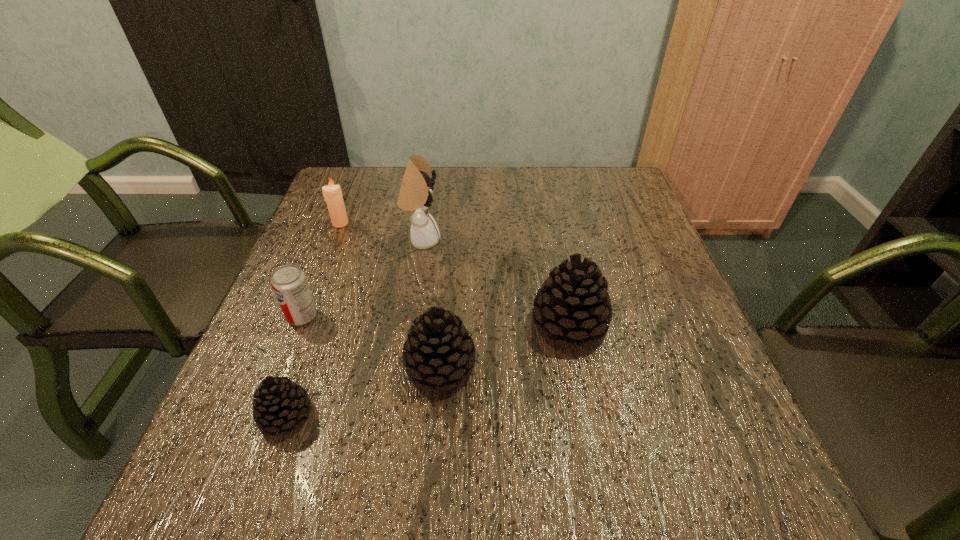
This screenshot has width=960, height=540. I want to click on the shortest pinecone, so click(x=280, y=403).

Find the location of a particular element. The width and height of the screenshot is (960, 540). the leftmost pinecone is located at coordinates pos(280,403).

The width and height of the screenshot is (960, 540). I want to click on the second pinecone from right to left, so click(439, 350).

Find the location of a particular element. The width and height of the screenshot is (960, 540). the rightmost pinecone is located at coordinates (573, 303).

Where is `doll`? doll is located at coordinates (415, 195).

Where is `candle`? The width and height of the screenshot is (960, 540). candle is located at coordinates (332, 194).

Identify the location of soda. The width and height of the screenshot is (960, 540). (289, 283).

The width and height of the screenshot is (960, 540). Find the location of `free location located 0.400m at the narrow end of the second pinecone from right to left`. free location located 0.400m at the narrow end of the second pinecone from right to left is located at coordinates (684, 366).

You are a GUI agent. You are given a task and a screenshot of the screen. Output one action in this format:
    pyautogui.click(x=<x>, y=<y>)
    Task: Click on the vacant space located at the narrow end of the rightmost object
    
    Given the screenshot: What is the action you would take?
    pyautogui.click(x=492, y=324)

Locate an element on the screen. This screenshot has width=960, height=540. vacant region located 0.180m at the narrow end of the rightmost object is located at coordinates 444,324.